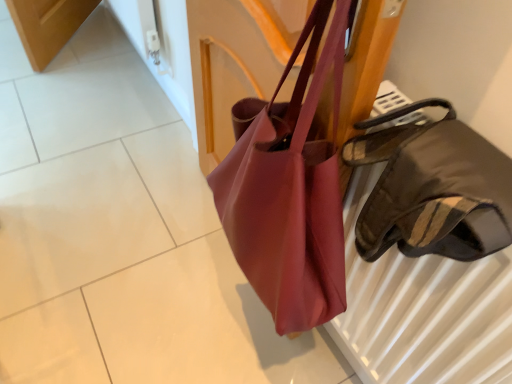
Question: From the image's perspective, is matte pink fabric bag at center beneath satin brown handbag at right, marked as the 1th handbag in a front-to-back arrangement?

Choices:
 (A) no
 (B) yes

Answer: (B)

Question: Is matte pink fabric bag at center far from satin brown handbag at right, positioned as the 1th handbag in right-to-left order?

Choices:
 (A) no
 (B) yes

Answer: (A)

Question: Is matte pink fabric bag at center at the right side of satin brown handbag at right, which appears as the 2th handbag when viewed from the back?

Choices:
 (A) no
 (B) yes

Answer: (A)

Question: Does matte pink fabric bag at center have a lesser width compared to satin brown handbag at right, marked as the second handbag in a left-to-right arrangement?

Choices:
 (A) no
 (B) yes

Answer: (A)

Question: Would you say matte pink fabric bag at center is outside satin brown handbag at right, which appears as the 2th handbag when viewed from the back?

Choices:
 (A) yes
 (B) no

Answer: (A)

Question: Is matte pink fabric bag at center to the left of satin brown handbag at right, which appears as the 2th handbag when viewed from the back, from the viewer's perspective?

Choices:
 (A) yes
 (B) no

Answer: (A)

Question: Does satin brown handbag at right, marked as the second handbag in a left-to-right arrangement, lie in front of matte pink fabric bag at center?

Choices:
 (A) yes
 (B) no

Answer: (A)

Question: Is satin brown handbag at right, positioned as the 1th handbag in right-to-left order, facing towards matte pink fabric bag at center?

Choices:
 (A) yes
 (B) no

Answer: (B)

Question: Can you confirm if satin brown handbag at right, marked as the 1th handbag in a front-to-back arrangement, is taller than matte pink fabric bag at center?

Choices:
 (A) no
 (B) yes

Answer: (B)

Question: Is satin brown handbag at right, marked as the second handbag in a left-to-right arrangement, at the left side of matte pink fabric bag at center?

Choices:
 (A) no
 (B) yes

Answer: (A)

Question: Would you say matte pink fabric bag at center is part of satin brown handbag at right, marked as the 1th handbag in a front-to-back arrangement,'s contents?

Choices:
 (A) no
 (B) yes

Answer: (A)

Question: Is satin brown handbag at right, positioned as the 1th handbag in right-to-left order, next to matte pink fabric bag at center and touching it?

Choices:
 (A) no
 (B) yes

Answer: (A)

Question: Considering the relative sizes of matte pink tote at center, the second handbag when ordered from right to left, and matte pink fabric bag at center in the image provided, is matte pink tote at center, the second handbag when ordered from right to left, shorter than matte pink fabric bag at center?

Choices:
 (A) yes
 (B) no

Answer: (B)